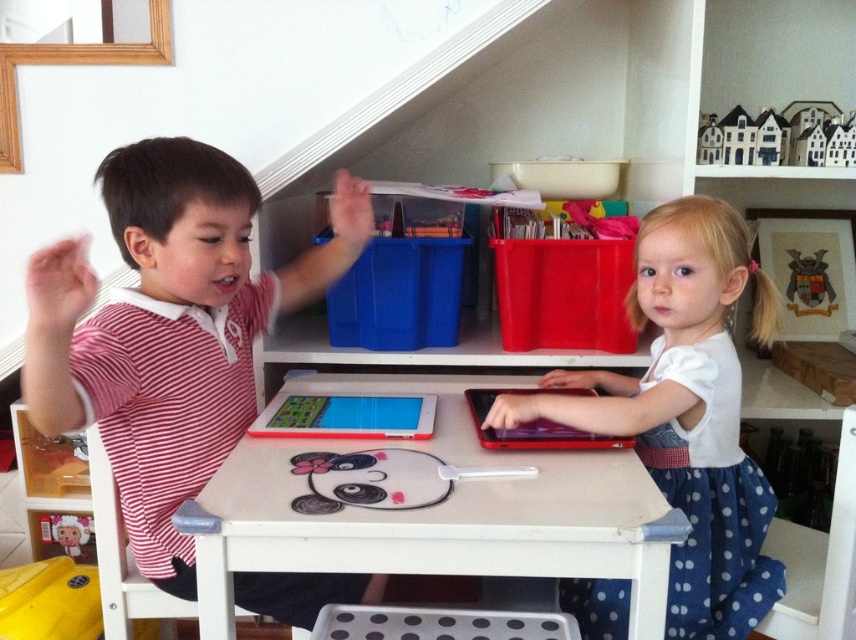
Question: Is white matte dress at right closer to camera compared to plush doll at lower left?

Choices:
 (A) no
 (B) yes

Answer: (B)

Question: Considering the real-world distances, which object is closest to the white painted wood table at center?

Choices:
 (A) white matte dress at right
 (B) metallic shield at upper right
 (C) plush doll at lower left
 (D) striped cotton shirt at left

Answer: (A)

Question: Can you confirm if striped cotton shirt at left is positioned to the right of metallic shield at upper right?

Choices:
 (A) yes
 (B) no

Answer: (B)

Question: Does striped cotton shirt at left appear on the left side of white painted wood table at center?

Choices:
 (A) no
 (B) yes

Answer: (B)

Question: Among these points, which one is nearest to the camera?

Choices:
 (A) (657, 545)
 (B) (88, 525)
 (C) (742, 547)
 (D) (120, 168)

Answer: (A)

Question: Which of the following is the closest to the observer?

Choices:
 (A) (563, 384)
 (B) (52, 540)
 (C) (833, 291)
 (D) (72, 326)

Answer: (D)